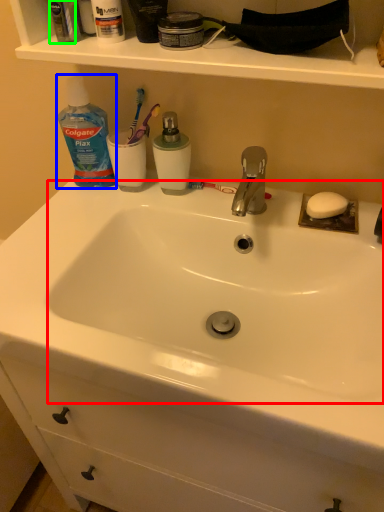
Question: Which object is positioned farthest from sink (highlighted by a red box)? Select from cleaning product (highlighted by a blue box) and mouthwash (highlighted by a green box).

Choices:
 (A) cleaning product
 (B) mouthwash

Answer: (B)